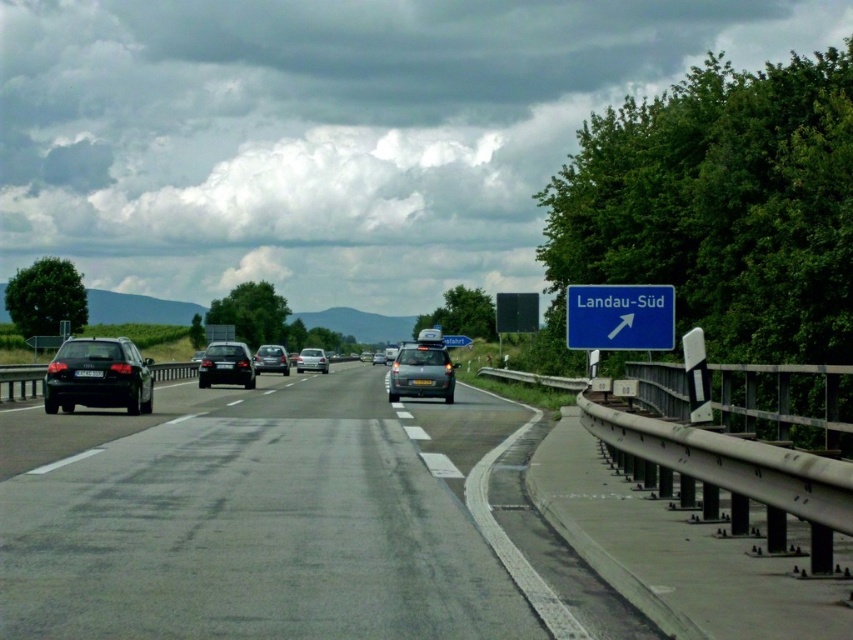
You are standing on the side of the highway and want to reach the point marked at coordinates (109, 371). Given that the average walking distance for an adult is about 3 feet per step, how many steps would it take to reach that point from your current position?

The point marked at coordinates (109, 371) is 73.13 feet away from the camera. Since the average walking distance per step is 3 feet, dividing 73.13 by 3 gives approximately 24.38 steps. Therefore, it would take roughly 24 steps to reach the point.

You are a drone operator trying to capture aerial footage of the highway. You have two points marked on your map for reference. The first point is at coordinates point (68, 372) and the second point is at point (383, 360). Which point should you prioritize filming if you want to capture the closest part of the highway to your current position?

Point (68, 372) is closer to the camera than point (383, 360), so you should prioritize filming point (68, 372) to capture the closest part of the highway to your current position.

You are standing on the side of the highway near the concrete barrier and want to cross to the other side. The shiny metallic car at center is approaching. If the car is 183.52 feet away, and you can walk at 3 miles per hour, how many seconds do you have before the car reaches your current position?

The shiny metallic car at center is 183.52 feet away from the viewer. To determine the time before it reaches your position, you need to know the car speed. Since the problem doesn not provide the car speed, it cannot be calculated.